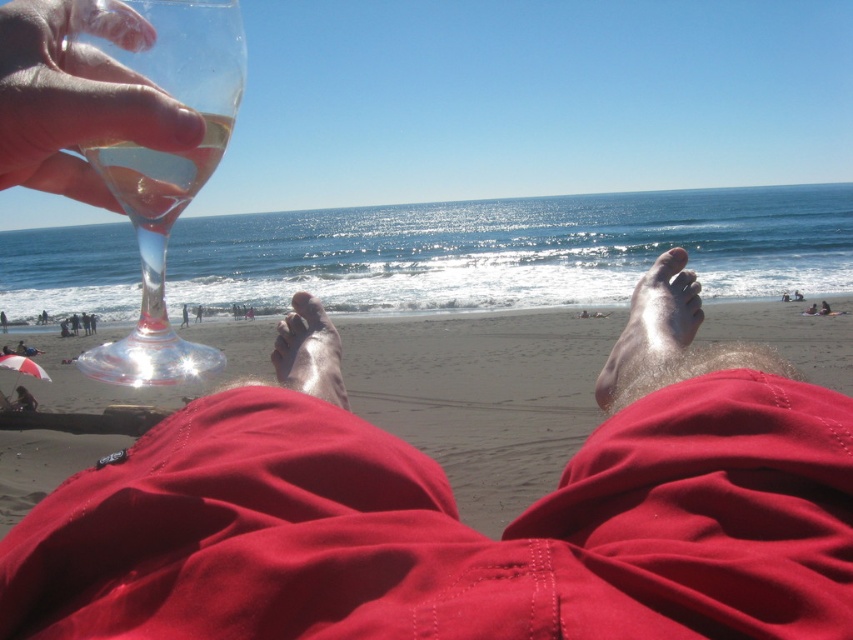
Question: Based on their relative distances, which object is nearer to the shiny skin foot at lower right?

Choices:
 (A) transparent glass wine glass at upper left
 (B) clear glass wine glass at upper left
 (C) clear glass wine at upper left
 (D) matte glass wine glass at upper left

Answer: (D)

Question: Considering the relative positions of matte glass wine glass at upper left and clear glass wine glass at upper left in the image provided, where is matte glass wine glass at upper left located with respect to clear glass wine glass at upper left?

Choices:
 (A) below
 (B) above

Answer: (A)

Question: Does transparent glass wine glass at upper left appear under clear glass wine at upper left?

Choices:
 (A) no
 (B) yes

Answer: (A)

Question: Can you confirm if transparent glass wine glass at upper left is positioned below shiny skin foot at lower right?

Choices:
 (A) yes
 (B) no

Answer: (B)

Question: Which point is closer to the camera?

Choices:
 (A) (679, 301)
 (B) (184, 182)
 (C) (167, 96)
 (D) (169, 508)

Answer: (D)

Question: Estimate the real-world distances between objects in this image. Which object is farther from the smooth skin foot at center?

Choices:
 (A) transparent glass wine glass at upper left
 (B) clear glass wine glass at upper left

Answer: (B)